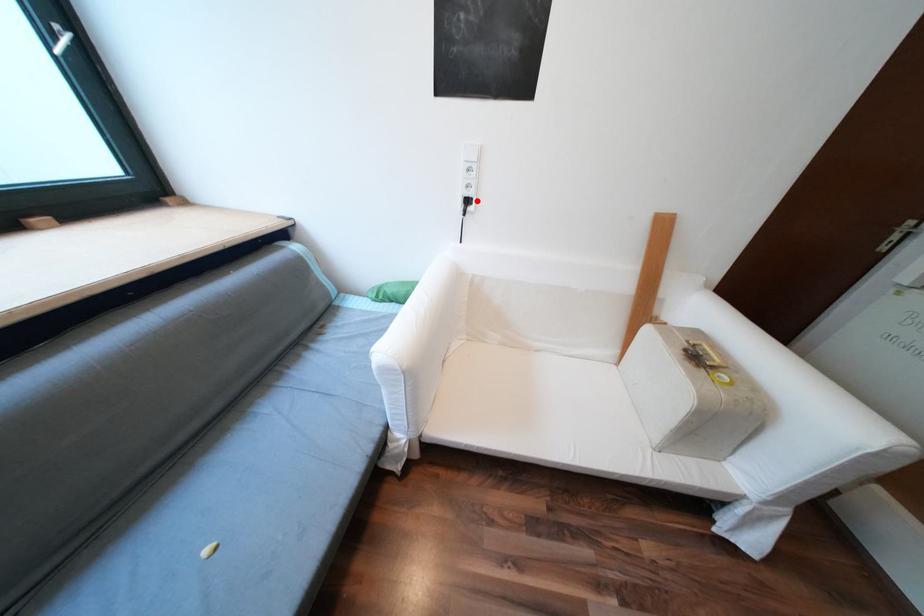
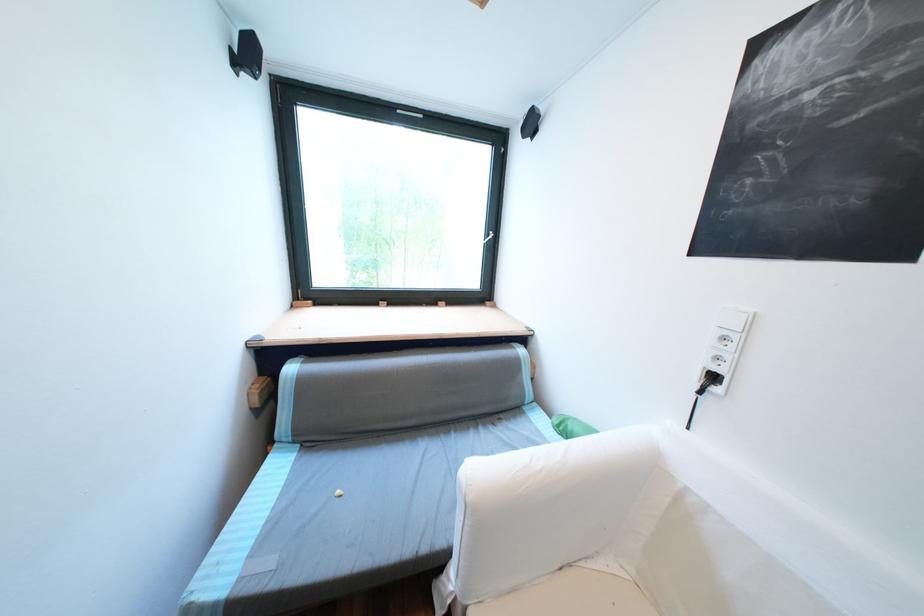
Locate, in the second image, the point that corresponds to the highlighted location in the first image.

(723, 378)